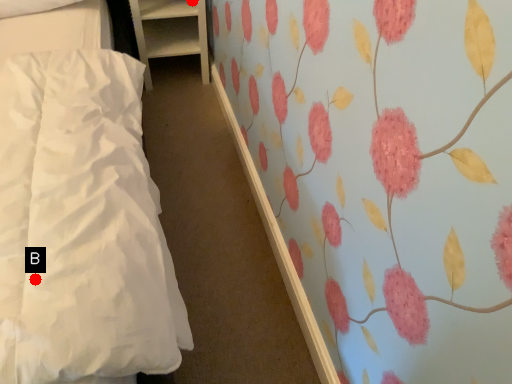
Question: Two points are circled on the image, labeled by A and B beside each circle. Which point appears farthest from the camera in this image?

Choices:
 (A) A is further
 (B) B is further

Answer: (A)